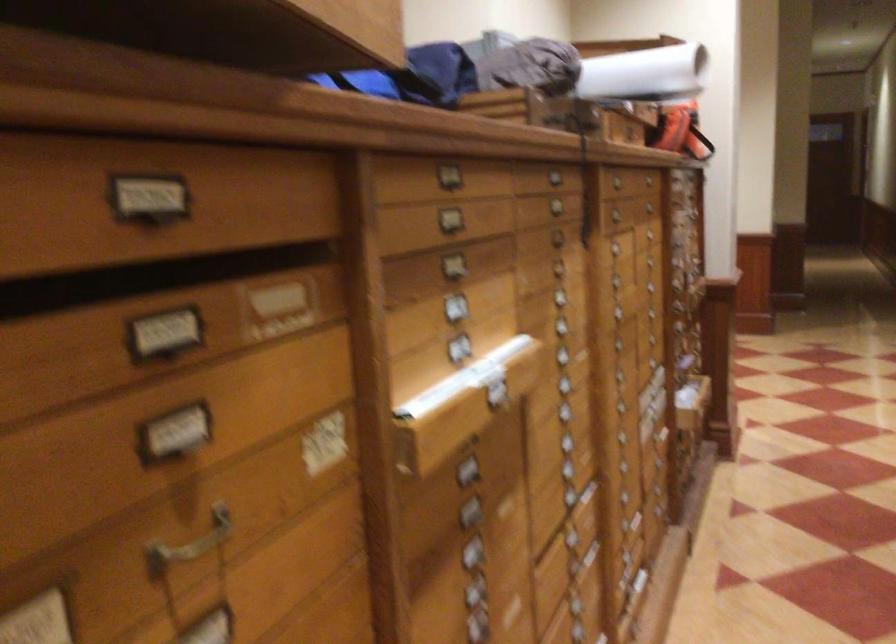
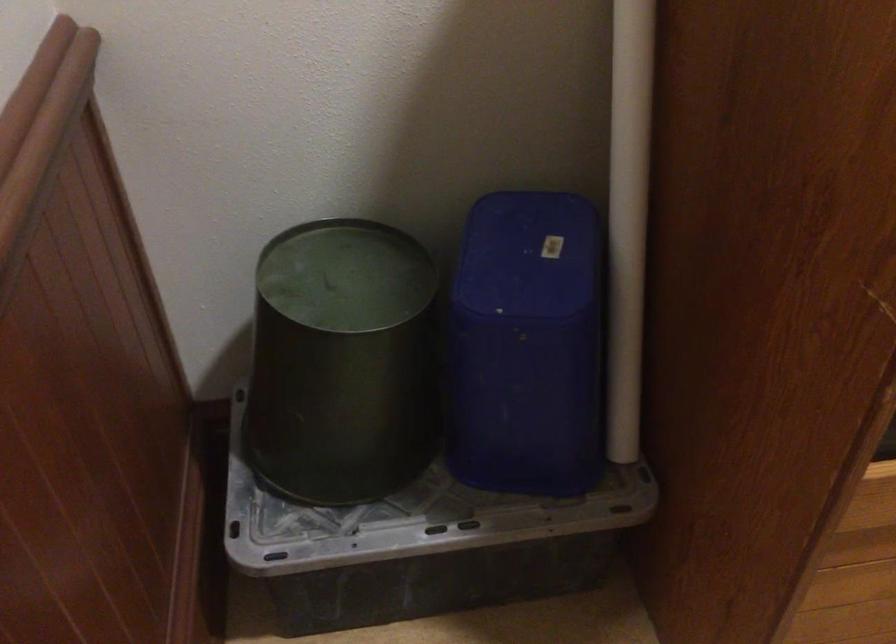
First-person continuous shooting, in which direction is the camera rotating?

The camera's rotation is toward left-down.